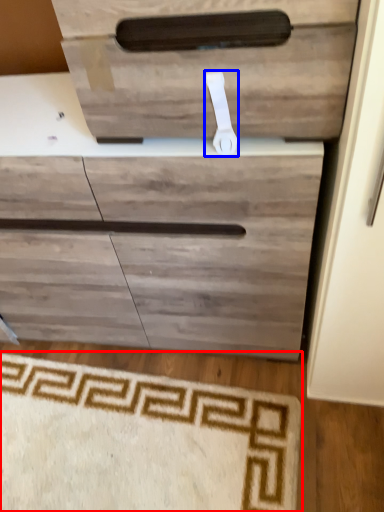
Question: Among these objects, which one is nearest to the camera, doormat (highlighted by a red box) or door handle (highlighted by a blue box)?

Choices:
 (A) doormat
 (B) door handle

Answer: (B)